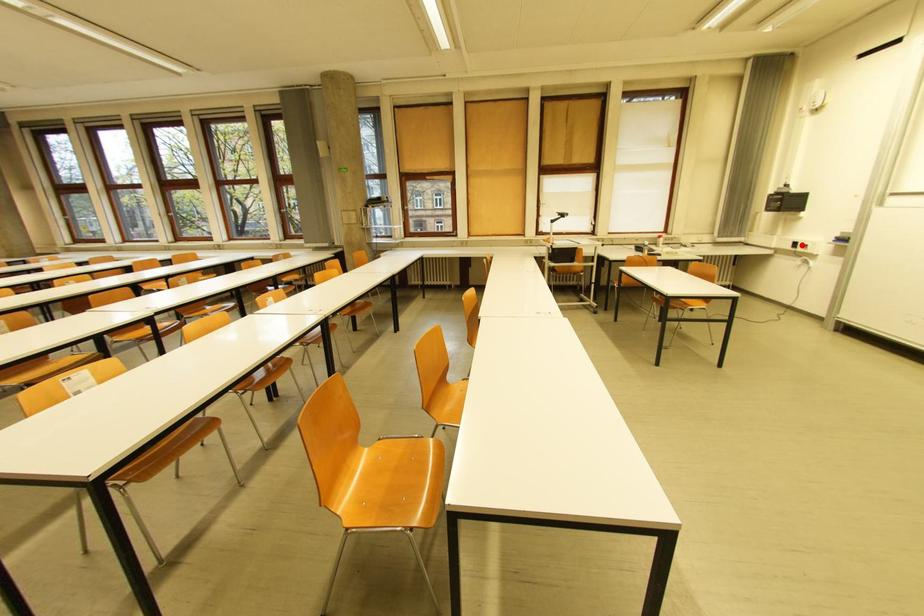
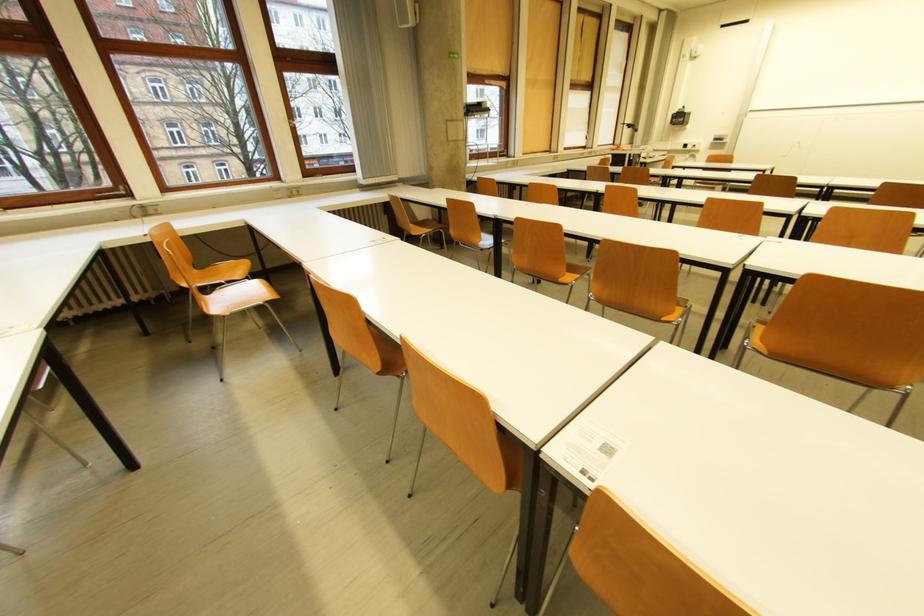
Locate, in the second image, the point that corresponds to the highlighted location in the first image.

(691, 147)